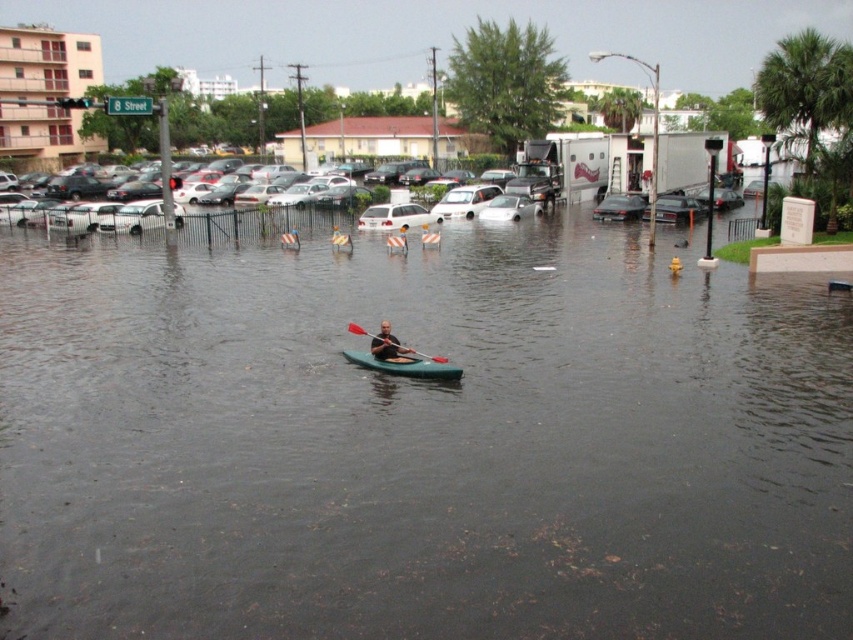
You are a drone operator trying to capture aerial footage of the flooded area. You notice two points in the image labeled as point 1 at coordinates (416, 372) and point 2 at coordinates (440, 211). Which point should you focus on if you want to capture the closest part of the scene to the camera?

Point 1 at coordinates (416, 372) is closer to the camera than point 2 at coordinates (440, 211), so you should focus on point 1 at coordinates (416, 372) to capture the closest part of the scene.

You are navigating a kayak through the flooded streets and need to reach a safe zone ahead. There are two points marked on your map at coordinates point (402, 372) and point (354, 323). Which point should you aim for first to stay on course?

You should aim for point (402, 372) first because it is in front of point (354, 323), meaning it is closer to your current position and the direction you are heading.